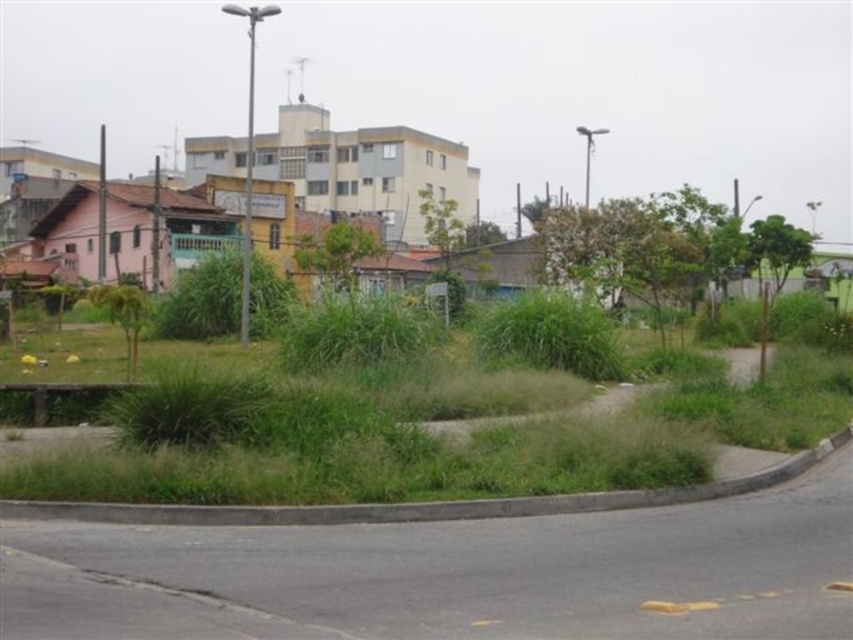
You are a gardener standing at the edge of the curved road in the urban scene. You need to decide which area to mow first between the green grass at lower center and the green grassy weed at lower left. Based on their positions, which one is closer to you?

The green grass at lower center is closer to the viewer than the green grassy weed at lower left, so you should mow the green grass at lower center first since it is nearer to your current position.